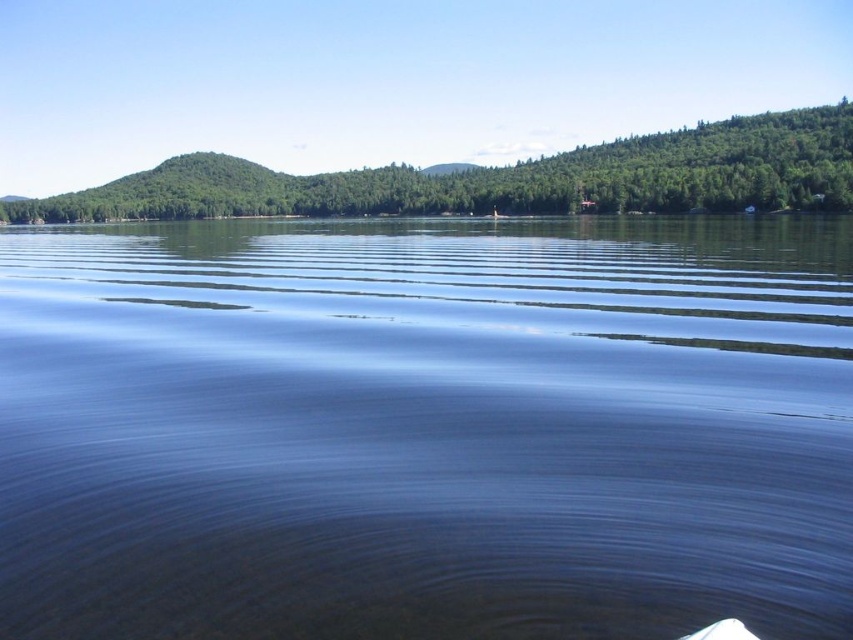
Question: Can you confirm if transparent water at center is smaller than green matte tree at upper center?

Choices:
 (A) no
 (B) yes

Answer: (B)

Question: Can you confirm if transparent water at center is positioned below green matte tree at upper center?

Choices:
 (A) no
 (B) yes

Answer: (B)

Question: Which point appears closest to the camera in this image?

Choices:
 (A) (0, 440)
 (B) (161, 202)

Answer: (A)

Question: Can you confirm if transparent water at center is positioned to the right of green matte tree at upper center?

Choices:
 (A) yes
 (B) no

Answer: (A)